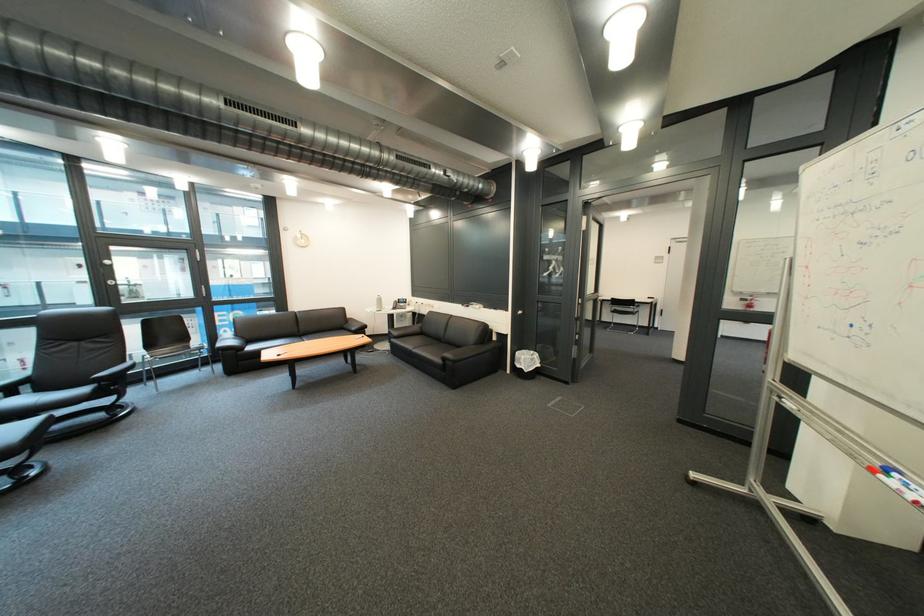
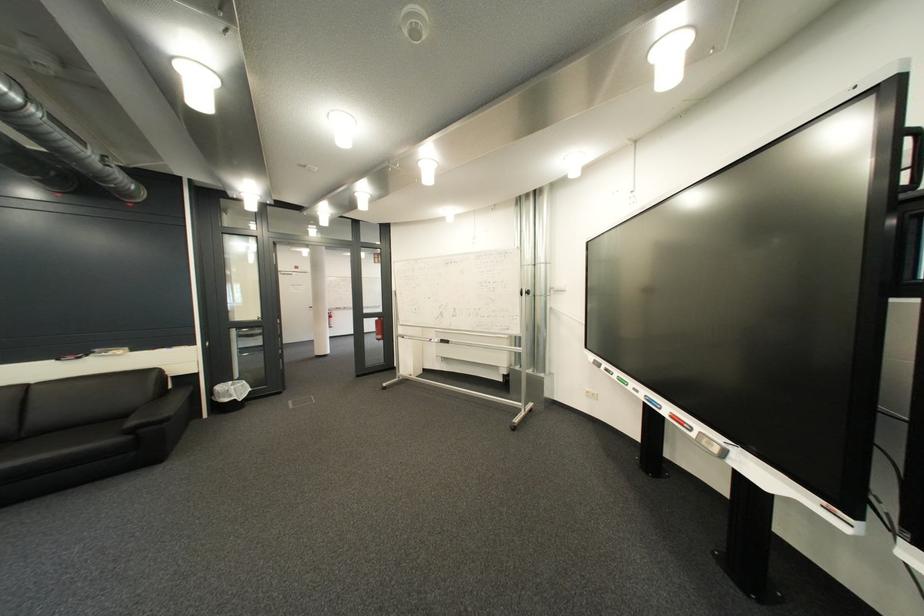
In the second image, find the point that corresponds to (456,344) in the first image.

(35, 440)